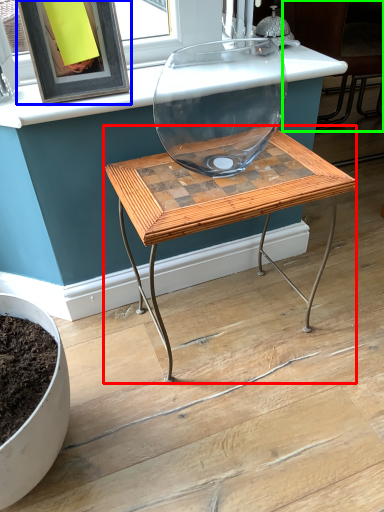
Question: Which object is the farthest from table (highlighted by a red box)? Choose among these: picture frame (highlighted by a blue box) or chair (highlighted by a green box).

Choices:
 (A) picture frame
 (B) chair

Answer: (B)